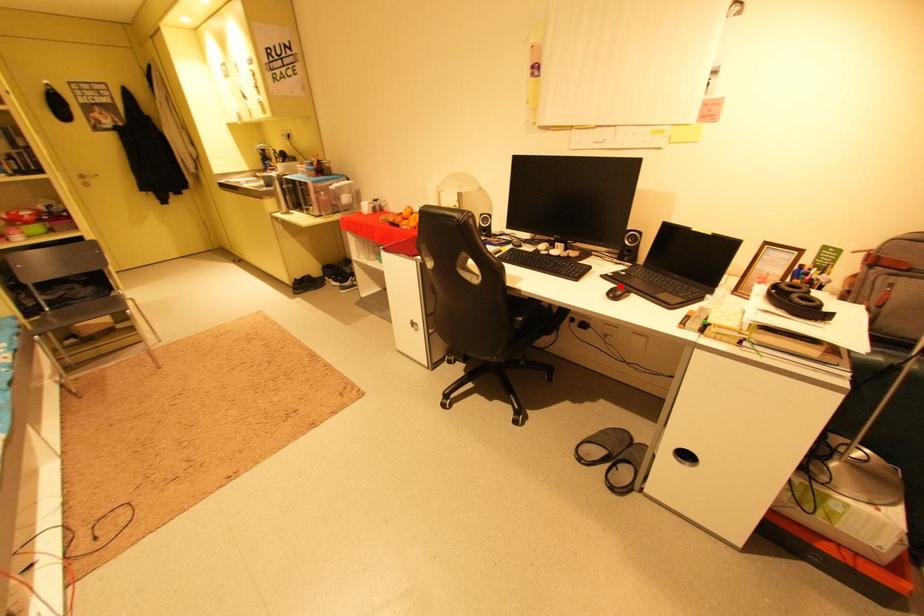
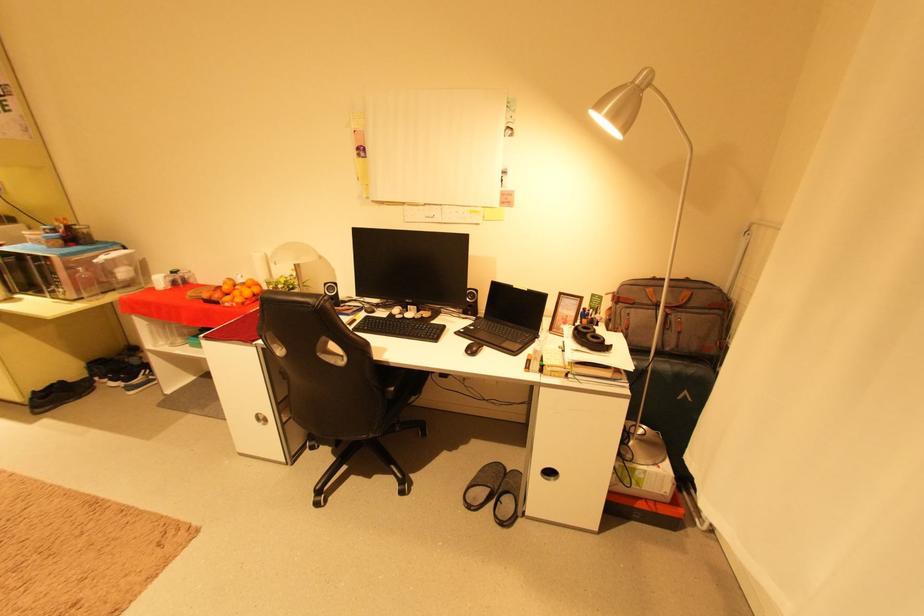
Locate, in the second image, the point that corresponds to the highlighted location in the first image.

(475, 342)